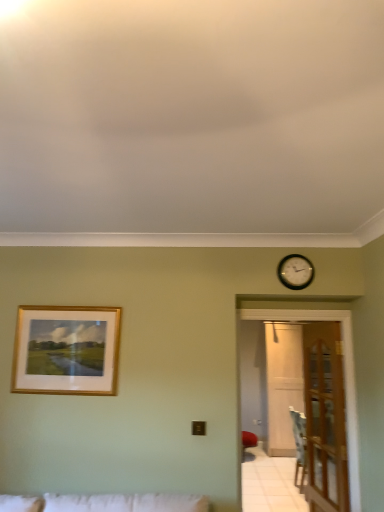
Identify the location of clear glass door at right, the 1th glass door when ordered from front to back. This screenshot has height=512, width=384. (344, 378).

The width and height of the screenshot is (384, 512). Identify the location of wooden at right. (325, 418).

Between clear glass door at right, which is counted as the 1th glass door, starting from the left, and transparent wooden door at right, positioned as the 1th glass door in right-to-left order, which one appears on the left side from the viewer's perspective?

clear glass door at right, which is counted as the 1th glass door, starting from the left.

From a real-world perspective, is clear glass door at right, the 1th glass door when ordered from front to back, on top of transparent wooden door at right, the 2th glass door viewed from the front?

Indeed, from a real-world perspective, clear glass door at right, the 1th glass door when ordered from front to back, stands above transparent wooden door at right, the 2th glass door viewed from the front.

Is there a large distance between clear glass door at right, which is counted as the 1th glass door, starting from the left, and transparent wooden door at right, the 2th glass door viewed from the front?

Yes, clear glass door at right, which is counted as the 1th glass door, starting from the left, and transparent wooden door at right, the 2th glass door viewed from the front, are located far from each other.

From their relative heights in the image, would you say clear glass door at right, the 1th glass door when ordered from front to back, is taller or shorter than transparent wooden door at right, positioned as the 1th glass door in right-to-left order?

In the image, clear glass door at right, the 1th glass door when ordered from front to back, appears to be shorter than transparent wooden door at right, positioned as the 1th glass door in right-to-left order.

From the image's perspective, between wooden at right and gold-framed picture at upper left, who is located below?

wooden at right appears lower in the image.

Is wooden at right to the left of gold-framed picture at upper left from the viewer's perspective?

No, wooden at right is not to the left of gold-framed picture at upper left.

Considering the sizes of objects wooden at right and gold-framed picture at upper left in the image provided, who is thinner, wooden at right or gold-framed picture at upper left?

gold-framed picture at upper left is thinner.

Can you see wooden at right touching gold-framed picture at upper left?

They are not placed beside each other.

Between gold-framed picture at upper left and wooden at right, which one has larger size?

wooden at right is bigger.

Is gold-framed picture at upper left turned away from wooden at right?

That's not correct — gold-framed picture at upper left is not looking away from wooden at right.

From a real-world perspective, is gold-framed picture at upper left positioned over wooden at right based on gravity?

Yes, from a real-world perspective, gold-framed picture at upper left is over wooden at right

Considering the positions of points (58, 374) and (340, 464), is point (58, 374) closer to camera compared to point (340, 464)?

Yes, it is.

Between gold-framed picture at upper left and clear glass door at right, the second glass door in the right-to-left sequence, which one is positioned in front?

Positioned in front is gold-framed picture at upper left.

Consider the image. Considering the sizes of gold-framed picture at upper left and clear glass door at right, the 1th glass door when ordered from front to back, in the image, is gold-framed picture at upper left wider or thinner than clear glass door at right, the 1th glass door when ordered from front to back,?

gold-framed picture at upper left is thinner than clear glass door at right, the 1th glass door when ordered from front to back.

Is point (115, 308) farther from camera compared to point (348, 396)?

No, it is not.

From the image's perspective, is gold-framed picture at upper left above clear glass door at right, the 1th glass door when ordered from front to back?

Correct, gold-framed picture at upper left appears higher than clear glass door at right, the 1th glass door when ordered from front to back, in the image.

Looking at their sizes, would you say black wooden clock at upper right is wider or thinner than clear glass door at right, which is counted as the 1th glass door, starting from the left?

Considering their sizes, black wooden clock at upper right looks slimmer than clear glass door at right, which is counted as the 1th glass door, starting from the left.

Which of these two, black wooden clock at upper right or clear glass door at right, which is counted as the 1th glass door, starting from the left, is smaller?

black wooden clock at upper right.

How different are the orientations of black wooden clock at upper right and clear glass door at right, the second glass door in the right-to-left sequence, in degrees?

2.04 degrees separate the facing orientations of black wooden clock at upper right and clear glass door at right, the second glass door in the right-to-left sequence.

From a real-world perspective, which is physically below, black wooden clock at upper right or clear glass door at right, which is counted as the 1th glass door, starting from the left?

From a 3D spatial view, clear glass door at right, which is counted as the 1th glass door, starting from the left, is below.

From a real-world perspective, which is physically below, transparent wooden door at right, the 2th glass door in the left-to-right sequence, or wooden at right?

In real-world perspective, transparent wooden door at right, the 2th glass door in the left-to-right sequence, is lower.

Is transparent wooden door at right, positioned as the 1th glass door in right-to-left order, positioned in front of wooden at right?

No, it is not.

What are the coordinates of `door located in front of the transparent wooden door at right, the 2th glass door viewed from the front` in the screenshot? It's located at (325, 418).

In the scene shown: Which object is closer to the camera taking this photo, clear glass door at right, the second glass door in the right-to-left sequence, or black wooden clock at upper right?

black wooden clock at upper right is more forward.

Does clear glass door at right, the second glass door in the right-to-left sequence, have a lesser width compared to black wooden clock at upper right?

No.

From the picture: From a real-world perspective, is clear glass door at right, which is counted as the 1th glass door, starting from the left, positioned over black wooden clock at upper right based on gravity?

No, from a real-world perspective, clear glass door at right, which is counted as the 1th glass door, starting from the left, is not above black wooden clock at upper right.

From the image's perspective, relative to black wooden clock at upper right, is clear glass door at right, which is counted as the 1th glass door, starting from the left, above or below?

clear glass door at right, which is counted as the 1th glass door, starting from the left, is below black wooden clock at upper right.

This screenshot has width=384, height=512. Identify the location of glass door on the left side of transparent wooden door at right, the 2th glass door viewed from the front. (344, 378).

Where is `door that is under the gold-framed picture at upper left (from a real-world perspective)`? door that is under the gold-framed picture at upper left (from a real-world perspective) is located at coordinates (325, 418).

Based on their spatial positions, is gold-framed picture at upper left or black wooden clock at upper right closer to wooden at right?

The object closer to wooden at right is black wooden clock at upper right.

Based on their spatial positions, is black wooden clock at upper right or wooden at right closer to transparent wooden door at right, marked as the first glass door in a back-to-front arrangement?

wooden at right is closer to transparent wooden door at right, marked as the first glass door in a back-to-front arrangement.

Which object lies nearer to the anchor point clear glass door at right, arranged as the 2th glass door when viewed from the back, transparent wooden door at right, positioned as the 1th glass door in right-to-left order, or gold-framed picture at upper left?

gold-framed picture at upper left is closer to clear glass door at right, arranged as the 2th glass door when viewed from the back.

From the image, which object appears to be farther from clear glass door at right, the second glass door in the right-to-left sequence, black wooden clock at upper right or transparent wooden door at right, marked as the first glass door in a back-to-front arrangement?

The object further to clear glass door at right, the second glass door in the right-to-left sequence, is transparent wooden door at right, marked as the first glass door in a back-to-front arrangement.

Consider the image. From the image, which object appears to be farther from black wooden clock at upper right, clear glass door at right, the second glass door in the right-to-left sequence, or gold-framed picture at upper left?

Based on the image, gold-framed picture at upper left appears to be further to black wooden clock at upper right.

In the scene shown: When comparing their distances from wooden at right, does gold-framed picture at upper left or clear glass door at right, which is counted as the 1th glass door, starting from the left, seem closer?

clear glass door at right, which is counted as the 1th glass door, starting from the left, is positioned closer to the anchor wooden at right.

From the image, which object appears to be farther from transparent wooden door at right, positioned as the 1th glass door in right-to-left order, gold-framed picture at upper left or black wooden clock at upper right?

The object further to transparent wooden door at right, positioned as the 1th glass door in right-to-left order, is gold-framed picture at upper left.

Considering their positions, is transparent wooden door at right, the 2th glass door in the left-to-right sequence, positioned closer to gold-framed picture at upper left than black wooden clock at upper right?

Based on the image, black wooden clock at upper right appears to be nearer to gold-framed picture at upper left.

This screenshot has height=512, width=384. In order to click on glass door between black wooden clock at upper right and wooden at right in the up-down direction in this screenshot , I will do `click(344, 378)`.

At what (x,y) coordinates should I click in order to perform the action: click on glass door between gold-framed picture at upper left and transparent wooden door at right, the 2th glass door viewed from the front, along the z-axis. Please return your answer as a coordinate pair (x, y). Image resolution: width=384 pixels, height=512 pixels. Looking at the image, I should click on (344, 378).

At what (x,y) coordinates should I click in order to perform the action: click on door between gold-framed picture at upper left and transparent wooden door at right, marked as the first glass door in a back-to-front arrangement, from front to back. Please return your answer as a coordinate pair (x, y). Looking at the image, I should click on (325, 418).

Locate an element on the screen. door between clear glass door at right, the 1th glass door when ordered from front to back, and transparent wooden door at right, the 2th glass door viewed from the front, in the front-back direction is located at coordinates (325, 418).